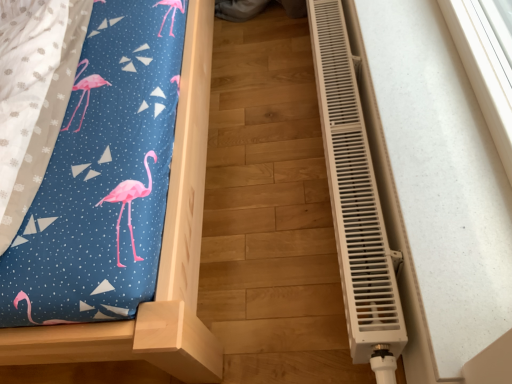
Where is `vacant point above white plastic radiator at right (from a real-world perspective)`? The image size is (512, 384). vacant point above white plastic radiator at right (from a real-world perspective) is located at coordinates (350, 120).